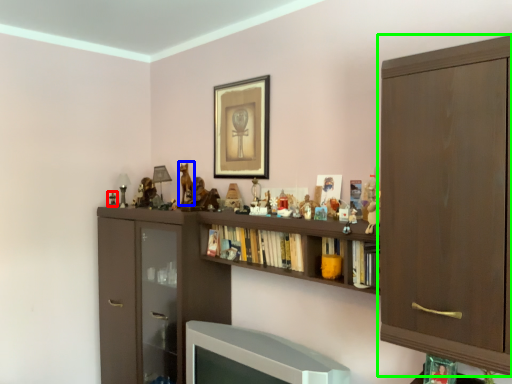
Question: Based on their relative distances, which object is nearer to toy (highlighted by a red box)? Choose from animal (highlighted by a blue box) and cabinetry (highlighted by a green box).

Choices:
 (A) animal
 (B) cabinetry

Answer: (A)